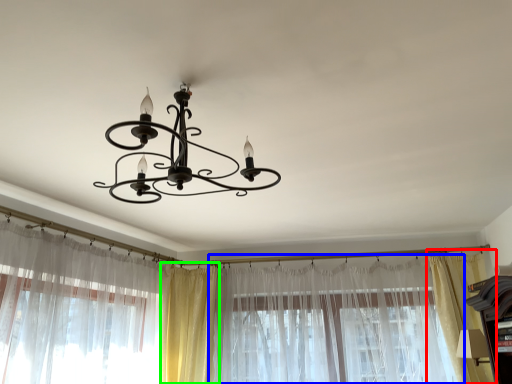
Question: Which is nearer to the curtain (highlighted by a red box)? curtain (highlighted by a blue box) or curtain (highlighted by a green box).

Choices:
 (A) curtain
 (B) curtain

Answer: (A)